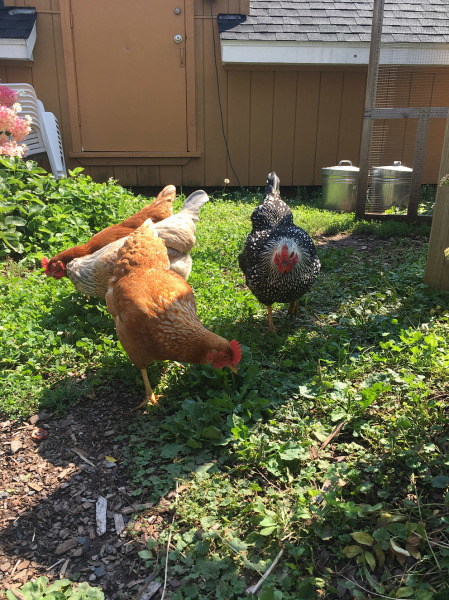
Locate an element on the screen. This screenshot has width=449, height=600. door is located at coordinates (152, 79).